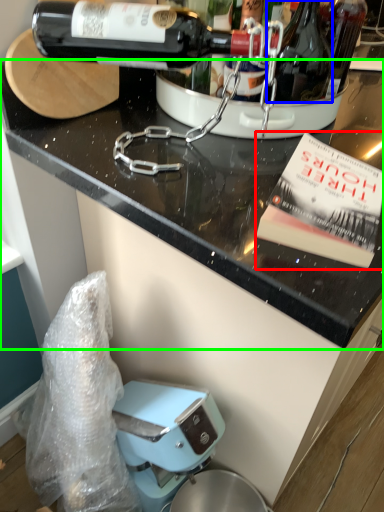
Question: Which object is positioned closest to paperback book (highlighted by a red box)? Select from bottle (highlighted by a blue box) and countertop (highlighted by a green box).

Choices:
 (A) bottle
 (B) countertop

Answer: (B)